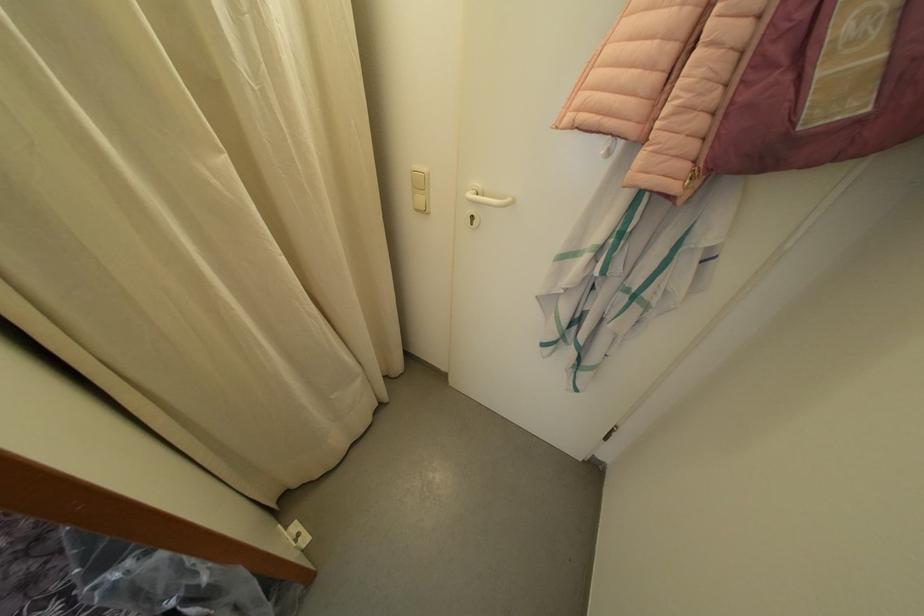
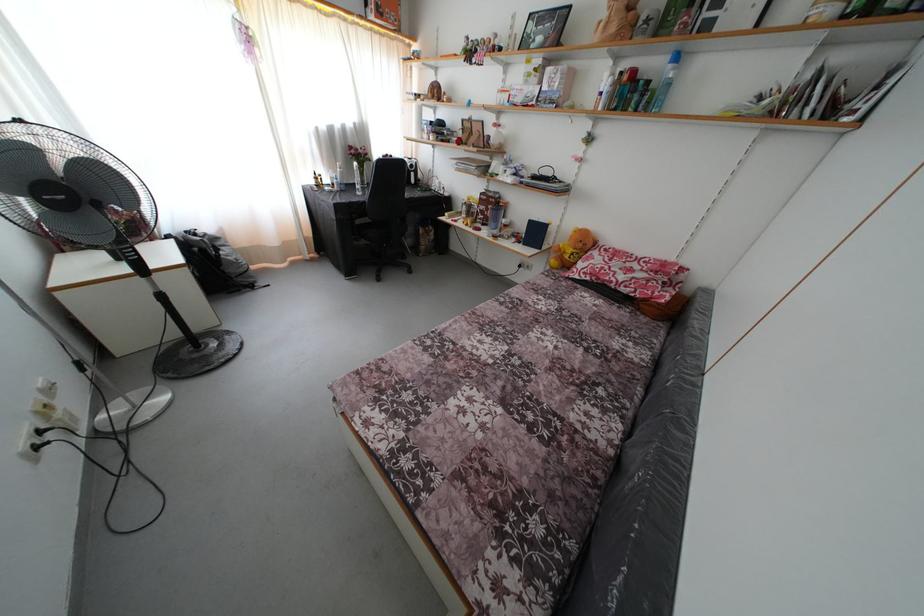
Based on the continuous images, in which direction is the camera rotating?

The camera rotated toward left-down.